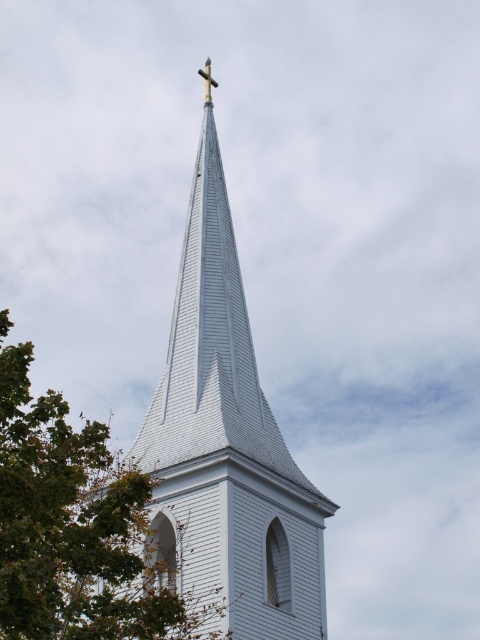
Question: Is green leafy tree at upper left above gold metallic cross at upper center?

Choices:
 (A) no
 (B) yes

Answer: (A)

Question: Does green leafy tree at upper left have a lesser width compared to gold metallic cross at upper center?

Choices:
 (A) no
 (B) yes

Answer: (A)

Question: Which point is farther to the camera?

Choices:
 (A) (215, 83)
 (B) (314, 611)
 (C) (84, 588)

Answer: (A)

Question: Does green leafy tree at upper left appear on the left side of gold metallic cross at upper center?

Choices:
 (A) no
 (B) yes

Answer: (B)

Question: Which point is farther to the camera?

Choices:
 (A) gold metallic cross at upper center
 (B) white wooden steeple at center
 (C) green leafy tree at upper left

Answer: (A)

Question: Which point is closer to the camera?

Choices:
 (A) (263, 628)
 (B) (204, 83)
 (C) (97, 538)

Answer: (C)